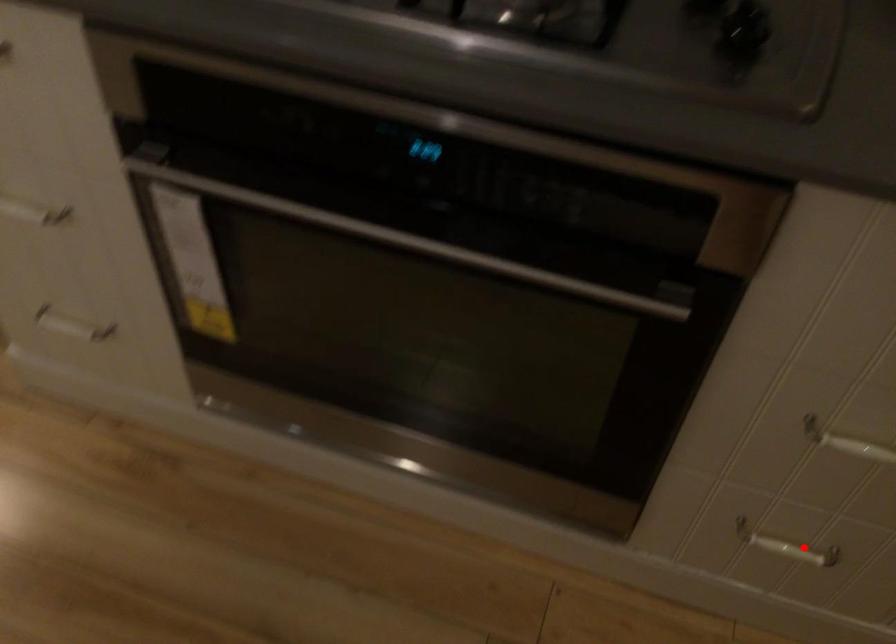
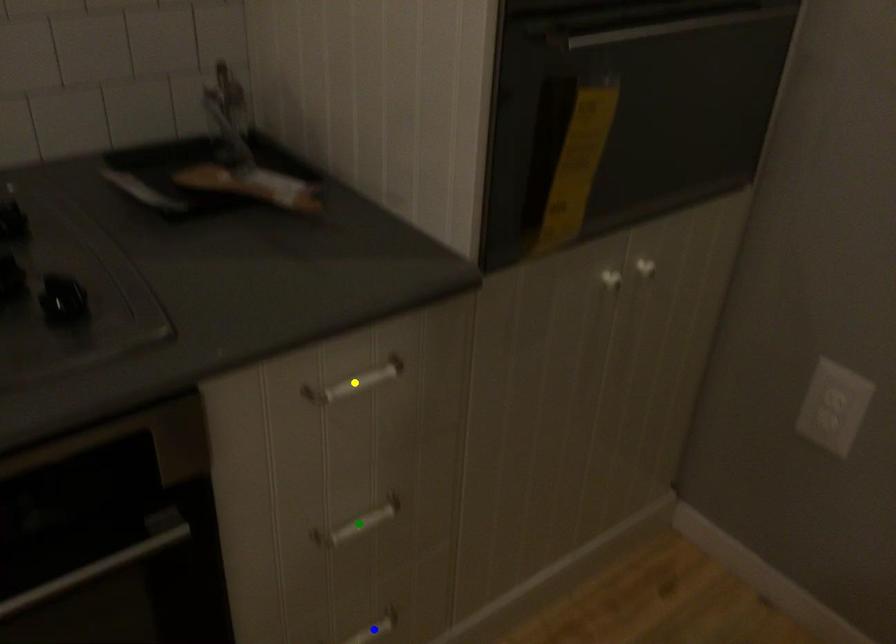
Question: I am providing you with two images of the same scene from different viewpoints. A red point is marked on the first image. You are given multiple points on the second image. Which spot in image 2 lines up with the point in image 1?

Choices:
 (A) yellow point
 (B) blue point
 (C) green point

Answer: (B)